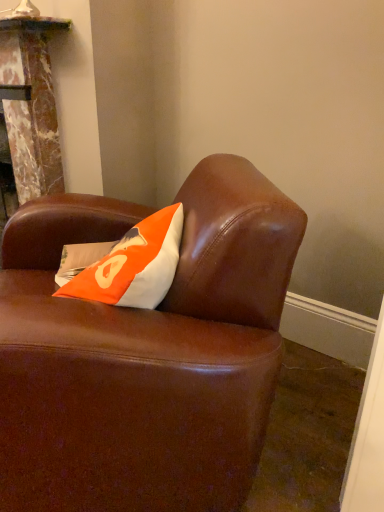
This screenshot has height=512, width=384. What do you see at coordinates (145, 353) in the screenshot? I see `brown leather couch at center` at bounding box center [145, 353].

Find the location of `brown leather couch at center`. brown leather couch at center is located at coordinates (145, 353).

Locate an element on the screen. This screenshot has height=512, width=384. brown leather couch at center is located at coordinates (145, 353).